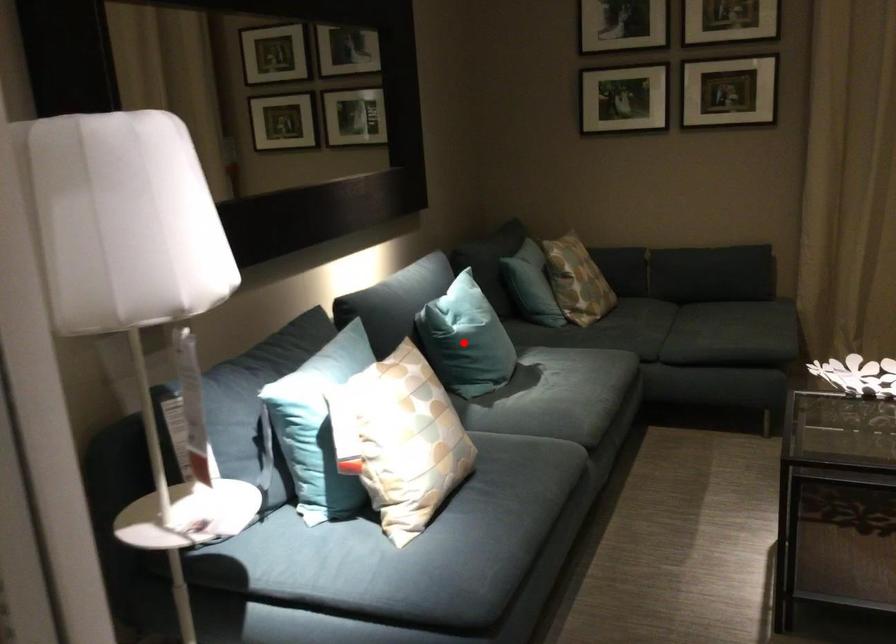
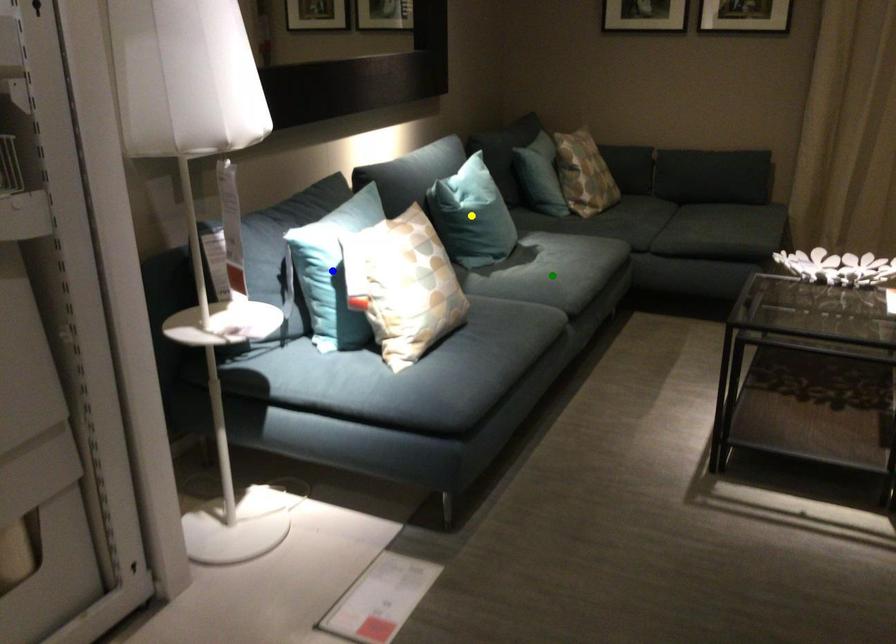
Question: I am providing you with two images of the same scene from different viewpoints. A red point is marked on the first image. You are given multiple points on the second image. Which point in image 2 is actually the same real-world point as the red point in image 1?

Choices:
 (A) yellow point
 (B) blue point
 (C) green point

Answer: (A)